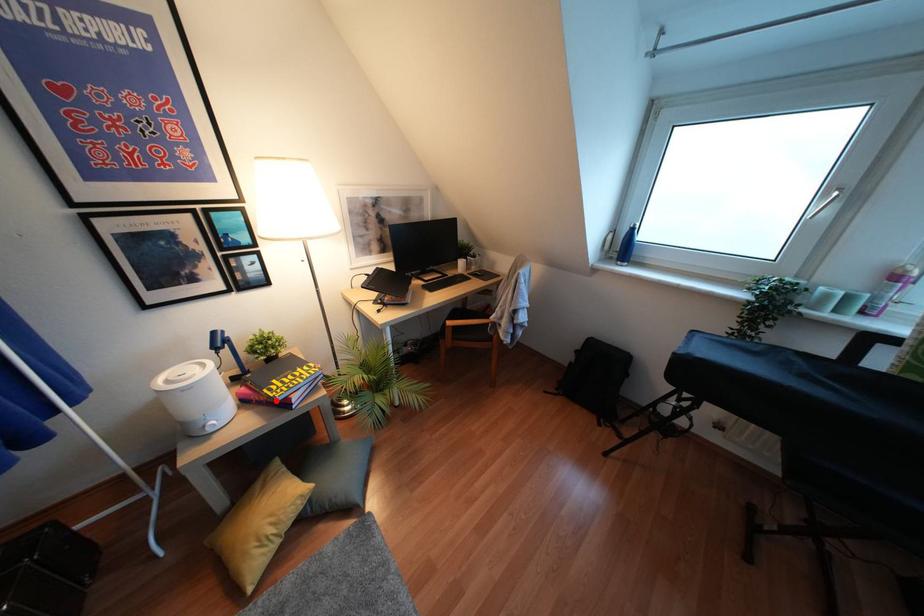
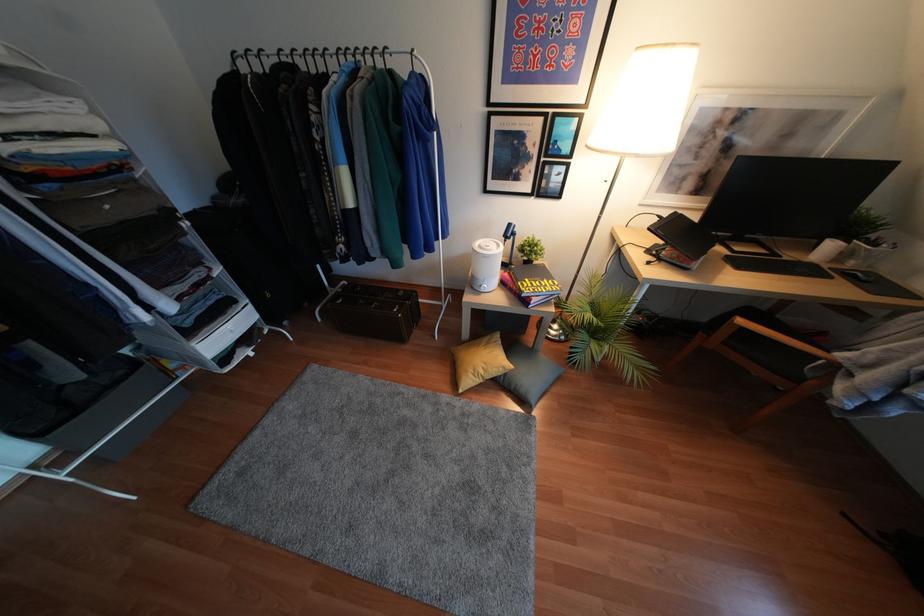
Locate, in the second image, the point that corresponds to the highlighted location in the first image.

(523, 294)